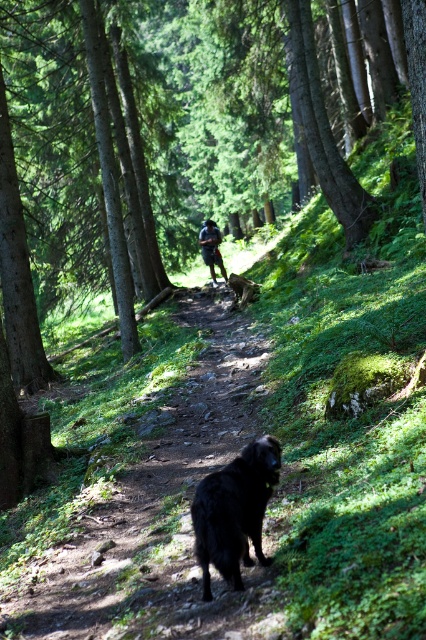
Based on the photo, is black fur dog at center positioned before dark blue fabric shirt at center?

Yes, black fur dog at center is in front of dark blue fabric shirt at center.

Is black fur dog at center below dark blue fabric shirt at center?

Indeed, black fur dog at center is positioned under dark blue fabric shirt at center.

The width and height of the screenshot is (426, 640). I want to click on black fur dog at center, so click(x=157, y=508).

Image resolution: width=426 pixels, height=640 pixels. What are the coordinates of `black fur dog at center` in the screenshot? It's located at [x=157, y=508].

Can you confirm if black fur dog at center is positioned above black furry dog at center?

Indeed, black fur dog at center is positioned over black furry dog at center.

Between black fur dog at center and black furry dog at center, which one appears on the left side from the viewer's perspective?

black fur dog at center is more to the left.

Between point (247, 611) and point (265, 436), which one is positioned behind?

The point (265, 436) is more distant.

This screenshot has height=640, width=426. I want to click on black fur dog at center, so click(x=157, y=508).

Between black furry dog at center and dark blue fabric shirt at center, which one is positioned higher?

Positioned higher is dark blue fabric shirt at center.

Is point (198, 497) more distant than point (210, 269)?

That is False.

This screenshot has width=426, height=640. Describe the element at coordinates (235, 512) in the screenshot. I see `black furry dog at center` at that location.

Where is `black furry dog at center`? black furry dog at center is located at coordinates (235, 512).